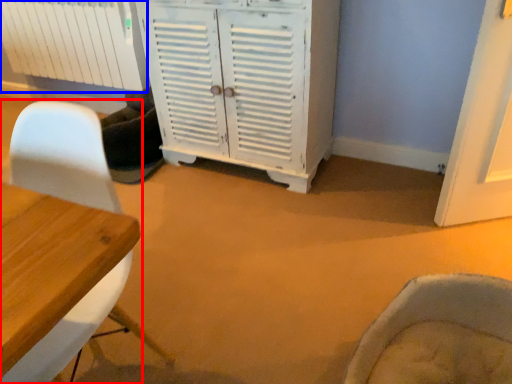
Question: Among these objects, which one is nearest to the camera, chair (highlighted by a red box) or radiator (highlighted by a blue box)?

Choices:
 (A) chair
 (B) radiator

Answer: (A)